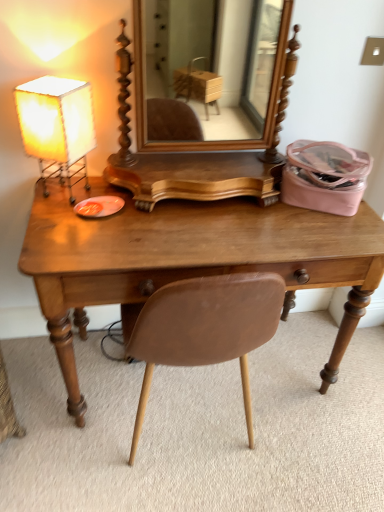
Find the location of `vacant space in front of matte white lampshade at left`. vacant space in front of matte white lampshade at left is located at coordinates (68, 220).